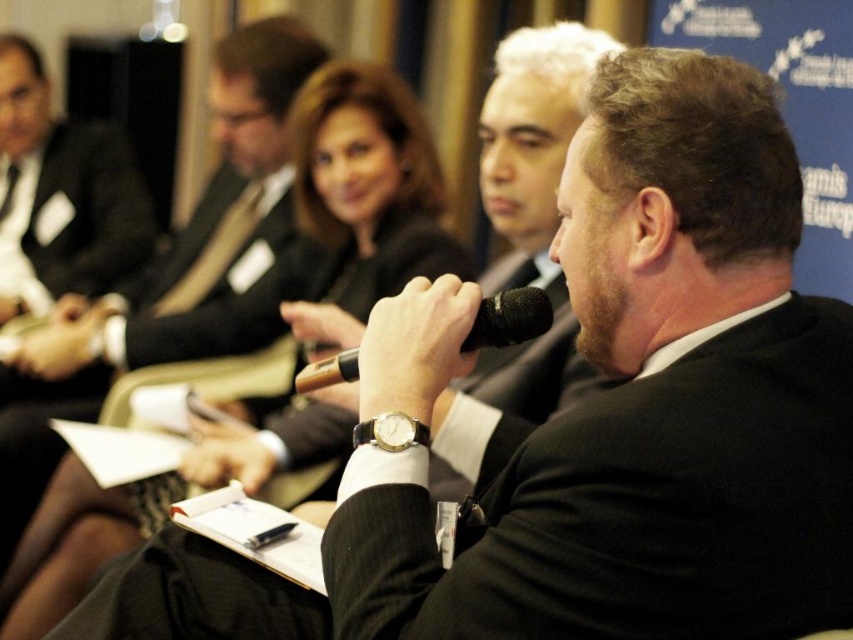
Question: Is black matte suit at center wider than matte black suit at left?

Choices:
 (A) no
 (B) yes

Answer: (A)

Question: Considering the real-world distances, which object is closest to the matte black suit at center?

Choices:
 (A) gold metallic watch at center
 (B) black matte suit at center
 (C) black matte microphone at center
 (D) matte black suit at left

Answer: (D)

Question: Which object appears closest to the camera in this image?

Choices:
 (A) matte black suit at center
 (B) gold metallic watch at center
 (C) black matte suit at center
 (D) black matte microphone at center

Answer: (C)

Question: Which object is farther from the camera taking this photo?

Choices:
 (A) black matte suit at center
 (B) matte black suit at left

Answer: (B)

Question: Is matte black suit at center wider than gold metallic watch at center?

Choices:
 (A) yes
 (B) no

Answer: (A)

Question: Is matte black suit at center thinner than matte black suit at left?

Choices:
 (A) yes
 (B) no

Answer: (B)